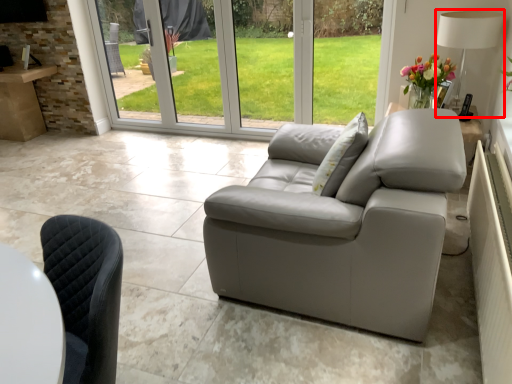
Question: Where is lamp (annotated by the red box) located in relation to pillow in the image?

Choices:
 (A) right
 (B) left

Answer: (A)